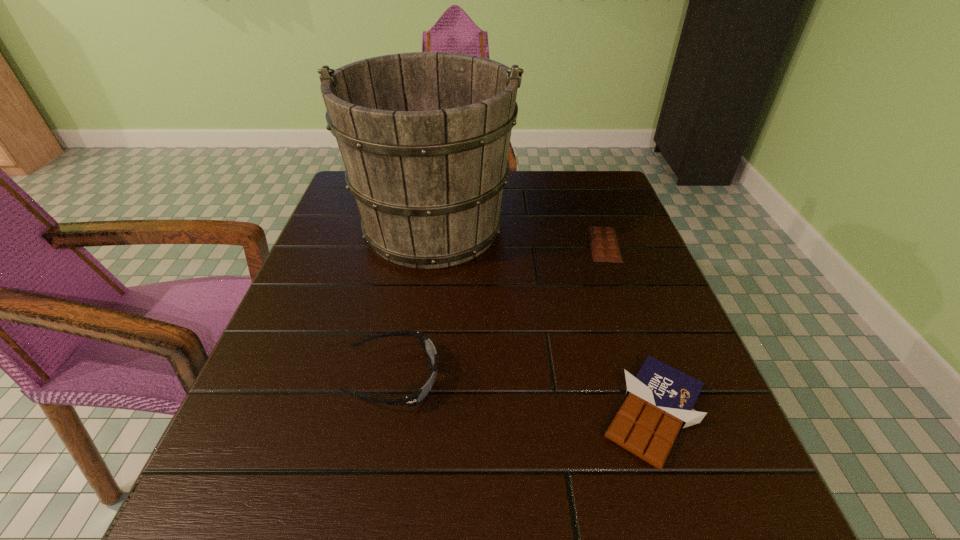
The height and width of the screenshot is (540, 960). Find the location of `bucket`. bucket is located at coordinates (424, 136).

The image size is (960, 540). Identify the location of sunglasses. (419, 395).

The image size is (960, 540). What are the coordinates of `the nearer chocolate bar` in the screenshot? It's located at (660, 399).

You are a GUI agent. You are given a task and a screenshot of the screen. Output one action in this format:
    pyautogui.click(x=<x>, y=<y>)
    Task: Click on the taller chocolate bar
    This screenshot has width=960, height=540.
    Given the screenshot: What is the action you would take?
    pyautogui.click(x=660, y=399)

At what (x,y) coordinates should I click in order to perform the action: click on the farther chocolate bar. Please return your answer as a coordinate pair (x, y). The image size is (960, 540). Looking at the image, I should click on (604, 245).

At what (x,y) coordinates should I click in order to perform the action: click on the shortest object. Please return your answer as a coordinate pair (x, y). Looking at the image, I should click on (604, 245).

Locate an element on the screen. This screenshot has width=960, height=540. vacant space located on the lenses of the sunglasses is located at coordinates (498, 378).

Where is `vacant space located on the back of the second shortest object`? The image size is (960, 540). vacant space located on the back of the second shortest object is located at coordinates (604, 263).

What are the coordinates of `blank space located 0.050m on the left of the shortest object` in the screenshot? It's located at (566, 245).

Locate an element on the screen. The width and height of the screenshot is (960, 540). object present at the far edge is located at coordinates (424, 136).